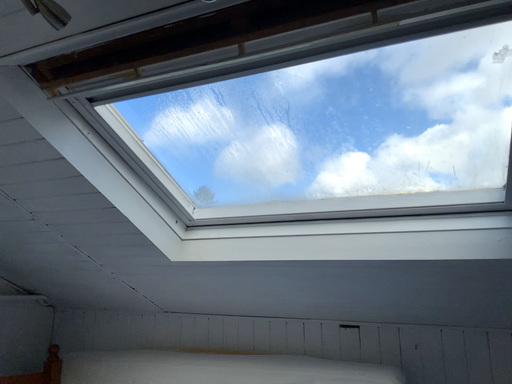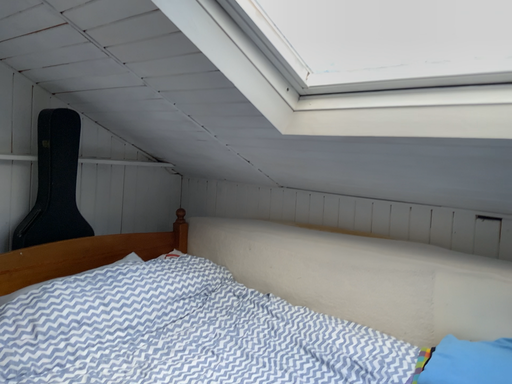
Question: How did the camera likely rotate when shooting the video?

Choices:
 (A) rotated right
 (B) rotated left

Answer: (B)